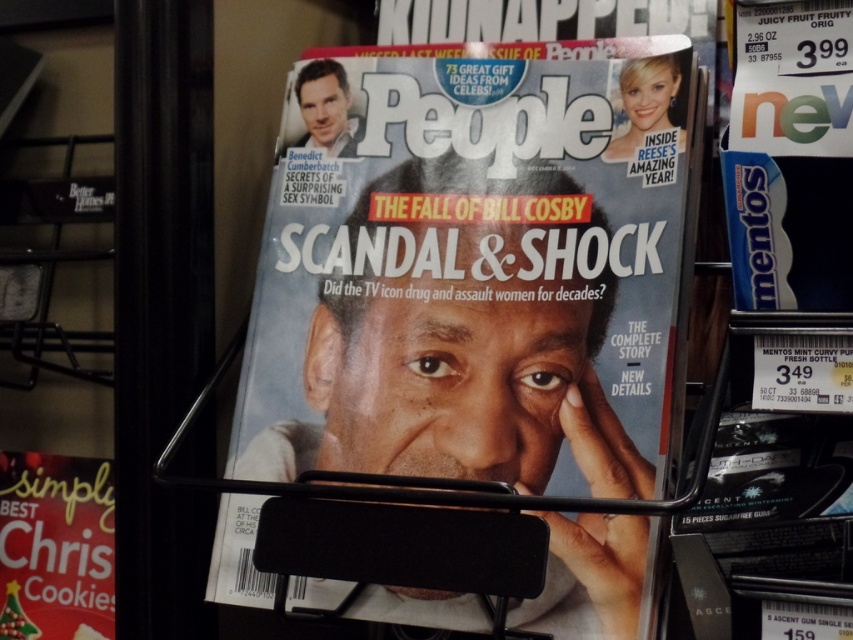
Question: Which object is closer to the camera taking this photo?

Choices:
 (A) matte red christmas cookies at lower left
 (B) matte paper magazine at center

Answer: (B)

Question: Does matte paper magazine at center appear under blue glossy mentos at right?

Choices:
 (A) no
 (B) yes

Answer: (B)

Question: Is matte paper magazine at center positioned behind matte red christmas cookies at lower left?

Choices:
 (A) no
 (B) yes

Answer: (A)

Question: Among these objects, which one is farthest from the camera?

Choices:
 (A) matte paper magazine at center
 (B) matte red christmas cookies at lower left
 (C) blue glossy mentos at right

Answer: (B)

Question: Where is blue glossy mentos at right located in relation to matte red christmas cookies at lower left in the image?

Choices:
 (A) above
 (B) below

Answer: (A)

Question: Which point is farther from the camera taking this photo?

Choices:
 (A) (32, 497)
 (B) (755, 272)

Answer: (A)